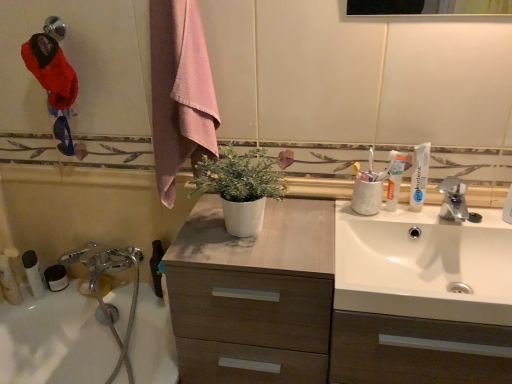
This screenshot has width=512, height=384. What are the coordinates of `free spot in front of white matte pot at center` in the screenshot? It's located at (253, 264).